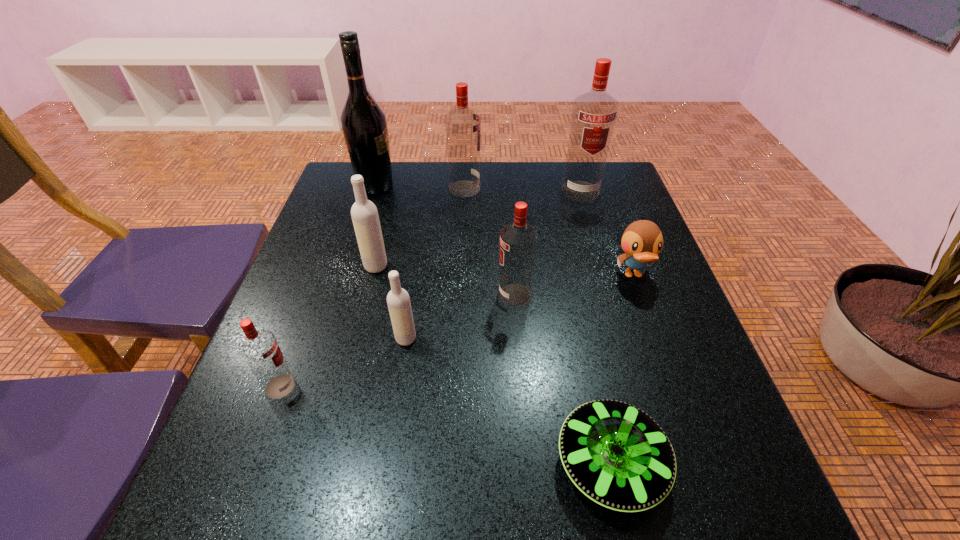
Locate an element on the screen. wine bottle that is at the left edge is located at coordinates (363, 121).

Locate an element on the screen. This screenshot has height=540, width=960. vodka that is at the right edge is located at coordinates (594, 113).

Identify the location of duck that is at the right edge. This screenshot has width=960, height=540. point(642,241).

Locate an element on the screen. Image resolution: width=960 pixels, height=540 pixels. saucer that is at the right edge is located at coordinates (617, 455).

Identify the location of object present at the far left corner. This screenshot has height=540, width=960. (363, 121).

Locate an element on the screen. object that is at the far right corner is located at coordinates (594, 113).

Locate an element on the screen. The width and height of the screenshot is (960, 540). object that is at the near right corner is located at coordinates (617, 455).

The image size is (960, 540). In the image, there is a desktop. Identify the location of vacant space at the far edge. (410, 194).

Where is `blank space at the near edge of the desktop`? The image size is (960, 540). blank space at the near edge of the desktop is located at coordinates (459, 512).

In the image, there is a desktop. Identify the location of free space at the left edge. (304, 247).